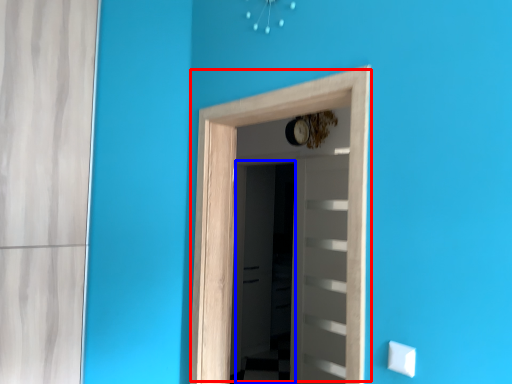
Question: Among these objects, which one is farthest to the camera, door (highlighted by a red box) or screen door (highlighted by a blue box)?

Choices:
 (A) door
 (B) screen door

Answer: (B)